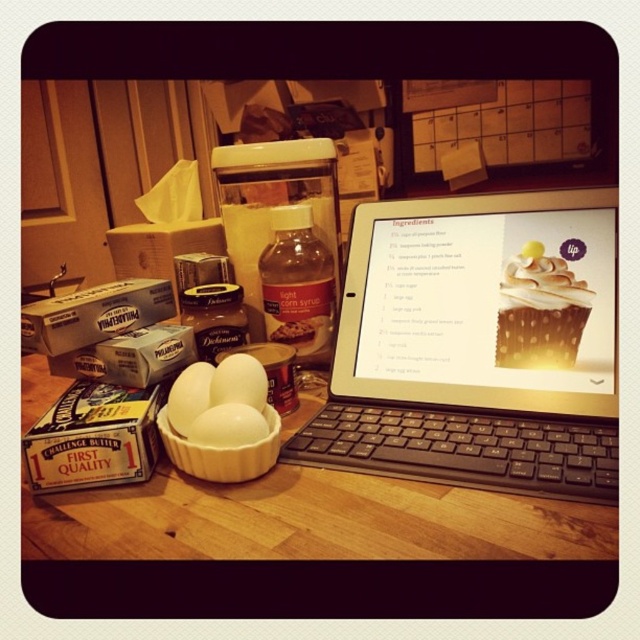
Question: In this image, where is white matte eggs at center located relative to white glossy egg at center?

Choices:
 (A) right
 (B) left

Answer: (B)

Question: Observing the image, what is the correct spatial positioning of white matte eggs at center in reference to white glossy egg at center?

Choices:
 (A) below
 (B) above

Answer: (A)

Question: Which object is farther from the camera taking this photo?

Choices:
 (A) black plastic tablet at center
 (B) white matte egg at center
 (C) golden brown cake at upper right
 (D) wooden table at center

Answer: (C)

Question: Is smokey brown meringue at upper right above white matte egg at center?

Choices:
 (A) no
 (B) yes

Answer: (B)

Question: Among these objects, which one is farthest from the camera?

Choices:
 (A) golden brown cake at upper right
 (B) smokey brown meringue at upper right
 (C) black plastic tablet at center

Answer: (B)

Question: Which point is closer to the camera?

Choices:
 (A) wooden table at center
 (B) smokey brown meringue at upper right
 (C) white glossy egg at center
 (D) white matte egg at center

Answer: (A)